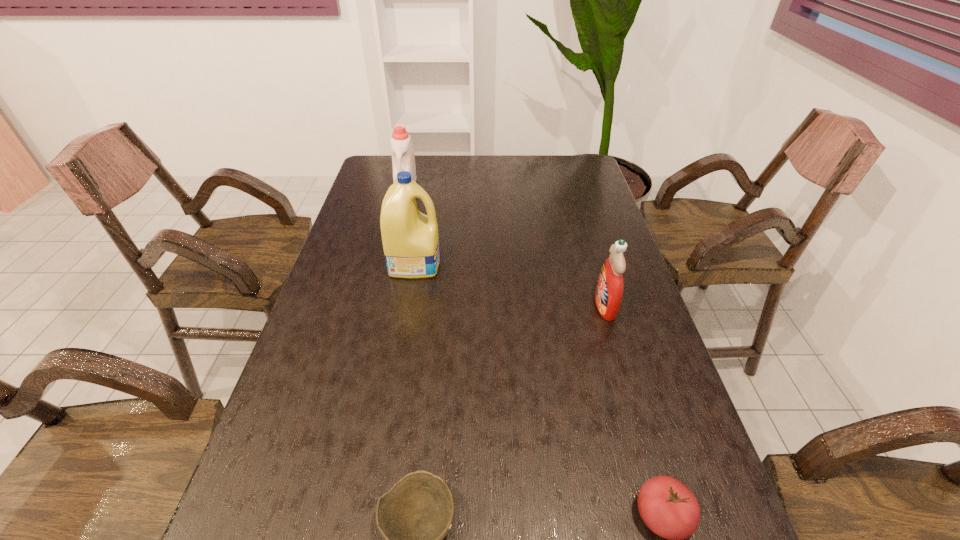
At what (x,y) coordinates should I click in order to perform the action: click on free spot between the second nearest detergent and the third nearest object. Please return your answer as a coordinate pair (x, y). Looking at the image, I should click on (510, 284).

Find the location of a particular element. vacant region between the nearest detergent and the tallest detergent is located at coordinates (510, 284).

Identify which object is located as the fourth nearest to the nearest detergent. Please provide its 2D coordinates. Your answer should be formatted as a tuple, i.e. [(x, y)], where the tuple contains the x and y coordinates of a point satisfying the conditions above.

[(403, 159)]

Locate which object ranks third in proximity to the tallest detergent. Please provide its 2D coordinates. Your answer should be formatted as a tuple, i.e. [(x, y)], where the tuple contains the x and y coordinates of a point satisfying the conditions above.

[(415, 515)]

Locate an element on the screen. the closest detergent relative to the fourth nearest object is located at coordinates (403, 159).

Find the location of a particular element. detergent that stands as the second closest to the farthest object is located at coordinates pos(609,290).